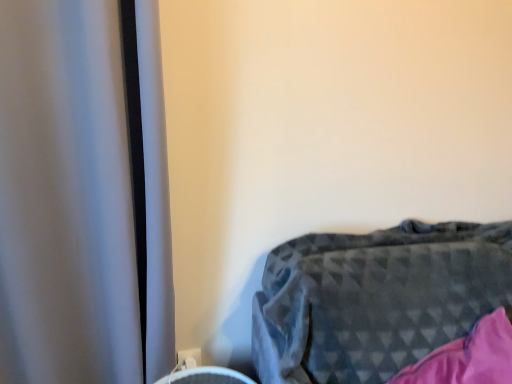
Identify the location of white plastic electric outlet at lower center. (188, 358).

Image resolution: width=512 pixels, height=384 pixels. Describe the element at coordinates (188, 358) in the screenshot. I see `white plastic electric outlet at lower center` at that location.

What do you see at coordinates (375, 299) in the screenshot? I see `dark gray textured blanket at lower right` at bounding box center [375, 299].

Locate an element on the screen. The width and height of the screenshot is (512, 384). dark gray textured blanket at lower right is located at coordinates (375, 299).

The height and width of the screenshot is (384, 512). What are the coordinates of `white plastic electric outlet at lower center` in the screenshot? It's located at (188, 358).

Between dark gray textured blanket at lower right and white plastic electric outlet at lower center, which one appears on the right side from the viewer's perspective?

dark gray textured blanket at lower right is more to the right.

Does dark gray textured blanket at lower right come in front of white plastic electric outlet at lower center?

Yes, dark gray textured blanket at lower right is closer to the viewer.

Considering the positions of point (439, 224) and point (192, 355), is point (439, 224) closer or farther from the camera than point (192, 355)?

Point (439, 224).

From the image's perspective, is dark gray textured blanket at lower right positioned above or below white plastic electric outlet at lower center?

From the image's perspective, dark gray textured blanket at lower right appears above white plastic electric outlet at lower center.

From a real-world perspective, who is located lower, dark gray textured blanket at lower right or white plastic electric outlet at lower center?

white plastic electric outlet at lower center, from a real-world perspective.

Which of these two, dark gray textured blanket at lower right or white plastic electric outlet at lower center, is thinner?

white plastic electric outlet at lower center is thinner.

Looking at this image, considering the sizes of objects dark gray textured blanket at lower right and white plastic electric outlet at lower center in the image provided, who is shorter, dark gray textured blanket at lower right or white plastic electric outlet at lower center?

Standing shorter between the two is white plastic electric outlet at lower center.

Based on their sizes in the image, would you say dark gray textured blanket at lower right is bigger or smaller than white plastic electric outlet at lower center?

In the image, dark gray textured blanket at lower right appears to be larger than white plastic electric outlet at lower center.

Does dark gray textured blanket at lower right contain white plastic electric outlet at lower center?

That's incorrect, white plastic electric outlet at lower center is not inside dark gray textured blanket at lower right.

Are dark gray textured blanket at lower right and white plastic electric outlet at lower center making contact?

dark gray textured blanket at lower right and white plastic electric outlet at lower center are not in contact.

Could you tell me if dark gray textured blanket at lower right is facing white plastic electric outlet at lower center?

No, dark gray textured blanket at lower right is not oriented towards white plastic electric outlet at lower center.

The image size is (512, 384). I want to click on furniture above the white plastic electric outlet at lower center (from a real-world perspective), so click(x=375, y=299).

Which is more to the right, white plastic electric outlet at lower center or dark gray textured blanket at lower right?

dark gray textured blanket at lower right is more to the right.

Which object is closer to the camera taking this photo, white plastic electric outlet at lower center or dark gray textured blanket at lower right?

Positioned in front is dark gray textured blanket at lower right.

Which point is more forward, (180,359) or (473,297)?

Point (473,297)

From the image's perspective, is white plastic electric outlet at lower center below dark gray textured blanket at lower right?

Indeed, from the image's perspective, white plastic electric outlet at lower center is shown beneath dark gray textured blanket at lower right.

From a real-world perspective, is white plastic electric outlet at lower center above or below dark gray textured blanket at lower right?

Clearly, from a real-world perspective, white plastic electric outlet at lower center is below dark gray textured blanket at lower right.

Considering the relative sizes of white plastic electric outlet at lower center and dark gray textured blanket at lower right in the image provided, is white plastic electric outlet at lower center wider than dark gray textured blanket at lower right?

No, white plastic electric outlet at lower center is not wider than dark gray textured blanket at lower right.

Between white plastic electric outlet at lower center and dark gray textured blanket at lower right, which one has less height?

Standing shorter between the two is white plastic electric outlet at lower center.

Is white plastic electric outlet at lower center bigger or smaller than dark gray textured blanket at lower right?

white plastic electric outlet at lower center is smaller than dark gray textured blanket at lower right.

Is white plastic electric outlet at lower center located outside dark gray textured blanket at lower right?

That's correct, white plastic electric outlet at lower center is outside of dark gray textured blanket at lower right.

Is white plastic electric outlet at lower center not close to dark gray textured blanket at lower right?

They are positioned close to each other.

Looking at this image, could you tell me if white plastic electric outlet at lower center is facing dark gray textured blanket at lower right?

No, white plastic electric outlet at lower center does not turn towards dark gray textured blanket at lower right.

How different are the orientations of white plastic electric outlet at lower center and dark gray textured blanket at lower right in degrees?

There is a 0.0979-degree angle between the facing directions of white plastic electric outlet at lower center and dark gray textured blanket at lower right.

Identify the location of furniture located in front of the white plastic electric outlet at lower center. (375, 299).

Identify the location of electric outlet below the dark gray textured blanket at lower right (from a real-world perspective). (188, 358).

This screenshot has height=384, width=512. There is a white plastic electric outlet at lower center. What are the coordinates of `furniture above it (from a real-world perspective)` in the screenshot? It's located at (375, 299).